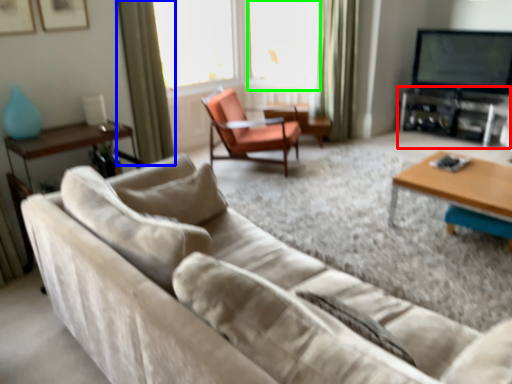
Question: Which object is positioned farthest from entertainment center (highlighted by a red box)? Select from curtain (highlighted by a blue box) and window screen (highlighted by a green box).

Choices:
 (A) curtain
 (B) window screen

Answer: (A)